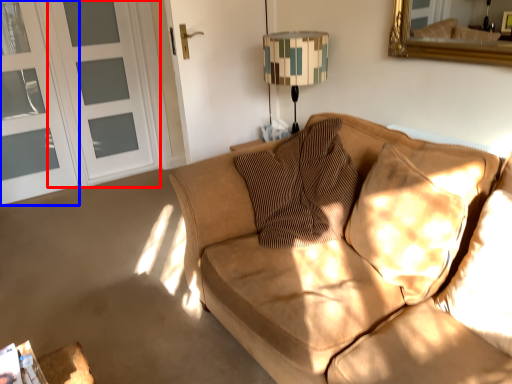
Question: Which point is closer to the camera, screen door (highlighted by a red box) or screen door (highlighted by a blue box)?

Choices:
 (A) screen door
 (B) screen door

Answer: (B)